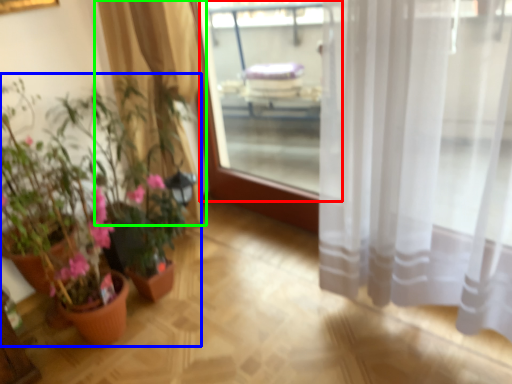
Question: Estimate the real-world distances between objects in this image. Which object is closer to window screen (highlighted by a red box), houseplant (highlighted by a blue box) or curtain (highlighted by a green box)?

Choices:
 (A) houseplant
 (B) curtain

Answer: (B)